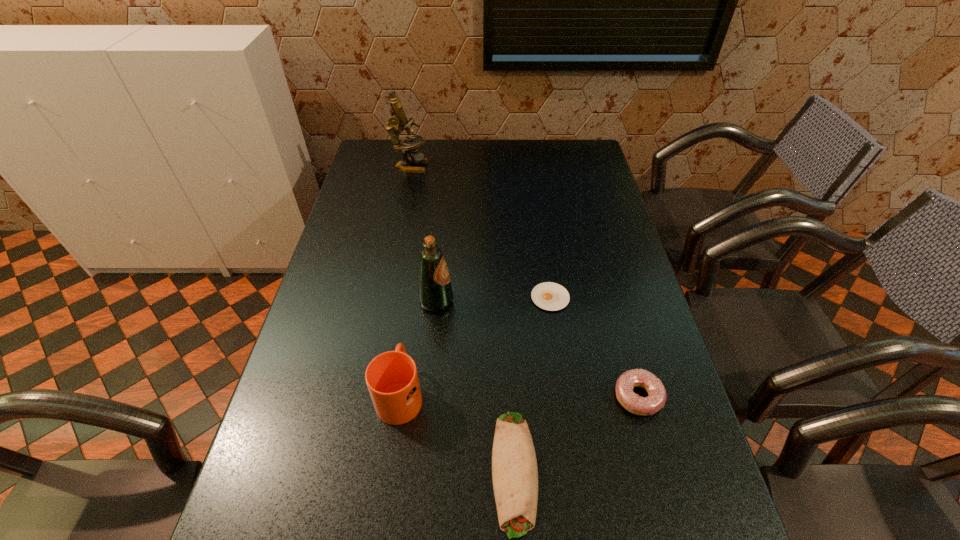
In order to click on vacant space at the left edge in this screenshot , I will do pyautogui.click(x=331, y=381).

In the image, there is a desktop. Where is `vacant space at the right edge`? vacant space at the right edge is located at coordinates pyautogui.click(x=598, y=328).

What are the coordinates of `vacant region at the far left corner of the desktop` in the screenshot? It's located at (382, 158).

This screenshot has height=540, width=960. What are the coordinates of `free space that is in between the second tallest object and the tallest object` in the screenshot? It's located at (423, 234).

In order to click on vacant space that is in between the shortest object and the mug in this screenshot , I will do `click(475, 346)`.

Find the location of a particular element. empty space that is in between the shortest object and the doughnut is located at coordinates (594, 347).

You are a GUI agent. You are given a task and a screenshot of the screen. Output one action in this format:
    pyautogui.click(x=<x>, y=<y>)
    Task: Click on the vacant space that's between the shortest object and the rightmost object
    The image size is (960, 540).
    Given the screenshot: What is the action you would take?
    pyautogui.click(x=594, y=347)

Where is `vacant space that's between the mug and the fourth tallest object`? This screenshot has height=540, width=960. vacant space that's between the mug and the fourth tallest object is located at coordinates (519, 395).

In order to click on vacant area that lies between the third shortest object and the third tallest object in this screenshot , I will do `click(519, 395)`.

You are a GUI agent. You are given a task and a screenshot of the screen. Output one action in this format:
    pyautogui.click(x=<x>, y=<y>)
    Task: Click on the free spot between the fifth object from left to right and the doughnut
    Image resolution: width=960 pixels, height=540 pixels.
    Given the screenshot: What is the action you would take?
    pyautogui.click(x=594, y=347)